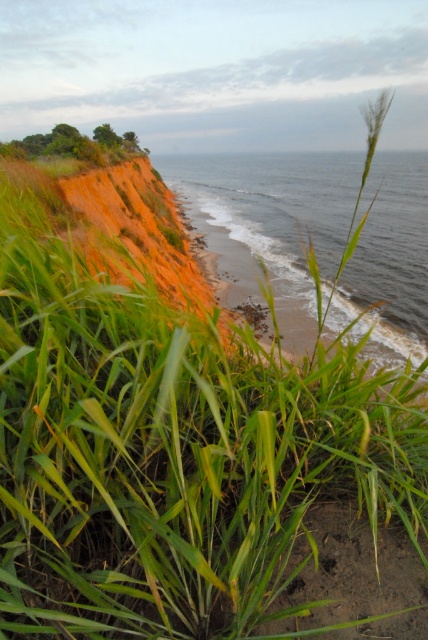
Question: Does blue water at center have a larger size compared to green grass at upper left?

Choices:
 (A) no
 (B) yes

Answer: (B)

Question: Does blue water at center lie in front of green grass at upper left?

Choices:
 (A) yes
 (B) no

Answer: (A)

Question: Among these points, which one is nearest to the camera?

Choices:
 (A) (89, 145)
 (B) (223, 180)

Answer: (A)

Question: Is blue water at center thinner than green grass at upper left?

Choices:
 (A) yes
 (B) no

Answer: (B)

Question: Among these objects, which one is farthest from the camera?

Choices:
 (A) blue water at center
 (B) green grass at upper left

Answer: (B)

Question: Which of the following is the farthest from the observer?

Choices:
 (A) blue water at center
 (B) green grass at upper left

Answer: (B)